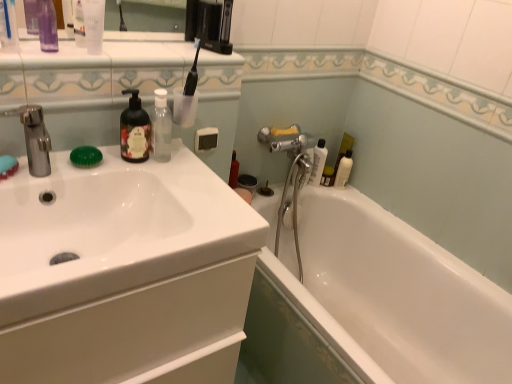
Identify the location of vacant space to the right of white glossy bottle at right, arranged as the 1th toiletry when viewed from the right. This screenshot has width=512, height=384. (362, 195).